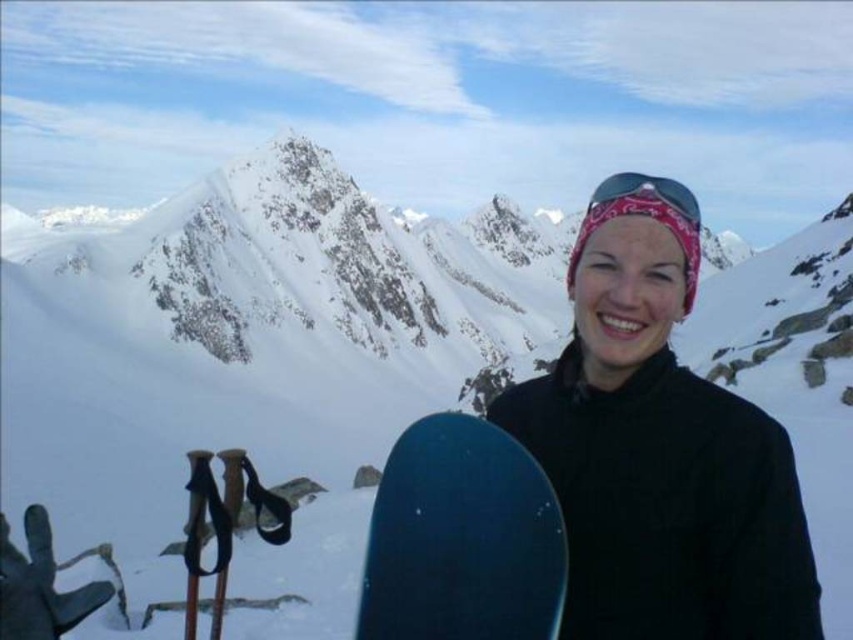
In the scene shown: Does matte black snowboard at lower center have a greater width compared to blue matte snowboard at center?

Indeed, matte black snowboard at lower center has a greater width compared to blue matte snowboard at center.

Between matte black snowboard at lower center and blue matte snowboard at center, which one has more height?

matte black snowboard at lower center

Between point (639, 572) and point (515, 557), which one is positioned in front?

Point (515, 557) is more forward.

I want to click on matte black snowboard at lower center, so click(x=659, y=456).

Is matte black snowboard at lower center positioned before pink fabric bandana at upper center?

Yes, it is in front of pink fabric bandana at upper center.

Who is more distant from viewer, (685, 218) or (689, 189)?

Positioned behind is point (689, 189).

Measure the distance between point (755,554) and camera.

Point (755,554) and camera are 136.75 feet apart from each other.

At what (x,y) coordinates should I click in order to perform the action: click on matte black snowboard at lower center. Please return your answer as a coordinate pair (x, y). Looking at the image, I should click on (659, 456).

Between blue matte snowboard at center and pink fabric bandana at upper center, which one has less height?

Standing shorter between the two is pink fabric bandana at upper center.

Describe the element at coordinates (462, 538) in the screenshot. I see `blue matte snowboard at center` at that location.

Locate an element on the screen. The image size is (853, 640). blue matte snowboard at center is located at coordinates (462, 538).

This screenshot has width=853, height=640. In order to click on blue matte snowboard at center in this screenshot , I will do `click(462, 538)`.